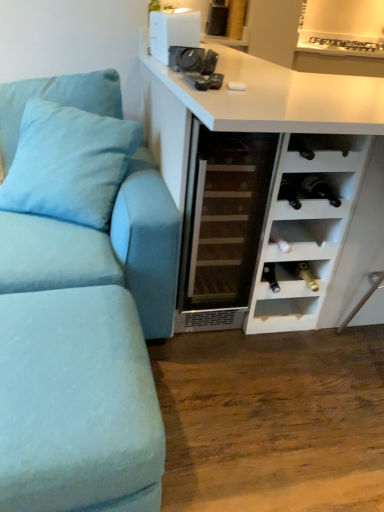
Question: Are white plastic speaker at upper center and transparent glass wine cooler at center beside each other?

Choices:
 (A) no
 (B) yes

Answer: (A)

Question: Is white plastic speaker at upper center bigger than transparent glass wine cooler at center?

Choices:
 (A) yes
 (B) no

Answer: (B)

Question: Is white plastic speaker at upper center looking in the opposite direction of transparent glass wine cooler at center?

Choices:
 (A) no
 (B) yes

Answer: (A)

Question: From the image's perspective, is white plastic speaker at upper center beneath transparent glass wine cooler at center?

Choices:
 (A) yes
 (B) no

Answer: (B)

Question: Is white plastic speaker at upper center positioned behind transparent glass wine cooler at center?

Choices:
 (A) no
 (B) yes

Answer: (B)

Question: Can transparent glass wine cooler at center be found inside white plastic speaker at upper center?

Choices:
 (A) yes
 (B) no

Answer: (B)

Question: Can you confirm if black matte wine bottle at lower right, the 4th shelf when ordered from top to bottom, is shorter than white matte wine cabinet at center?

Choices:
 (A) yes
 (B) no

Answer: (A)

Question: Can white matte wine cabinet at center be found inside black matte wine bottle at lower right, the 4th shelf when ordered from top to bottom?

Choices:
 (A) no
 (B) yes

Answer: (A)

Question: Could you tell me if black matte wine bottle at lower right, the 4th shelf when ordered from top to bottom, is turned towards white matte wine cabinet at center?

Choices:
 (A) no
 (B) yes

Answer: (B)

Question: Considering the relative sizes of black matte wine bottle at lower right, the 4th shelf when ordered from top to bottom, and white matte wine cabinet at center in the image provided, is black matte wine bottle at lower right, the 4th shelf when ordered from top to bottom, wider than white matte wine cabinet at center?

Choices:
 (A) no
 (B) yes

Answer: (A)

Question: Considering the relative sizes of black matte wine bottle at lower right, the 4th shelf when ordered from top to bottom, and white matte wine cabinet at center in the image provided, is black matte wine bottle at lower right, the 4th shelf when ordered from top to bottom, bigger than white matte wine cabinet at center?

Choices:
 (A) no
 (B) yes

Answer: (A)

Question: From a real-world perspective, is black matte wine bottle at lower right, which appears as the first shelf when ordered from the bottom, on top of white matte wine cabinet at center?

Choices:
 (A) yes
 (B) no

Answer: (B)

Question: From the image's perspective, is white matte wine rack at right, placed as the 1th shelf when sorted from top to bottom, beneath light blue fabric pillow at left?

Choices:
 (A) no
 (B) yes

Answer: (B)